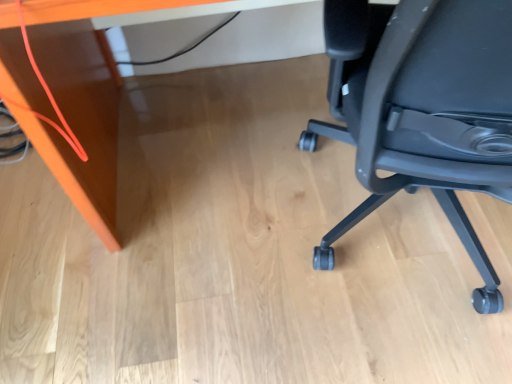
At what (x,y) coordinates should I click in order to perform the action: click on vacant region to the left of black plastic chair at right. Please return your answer as a coordinate pair (x, y). The image size is (512, 384). Looking at the image, I should click on (185, 296).